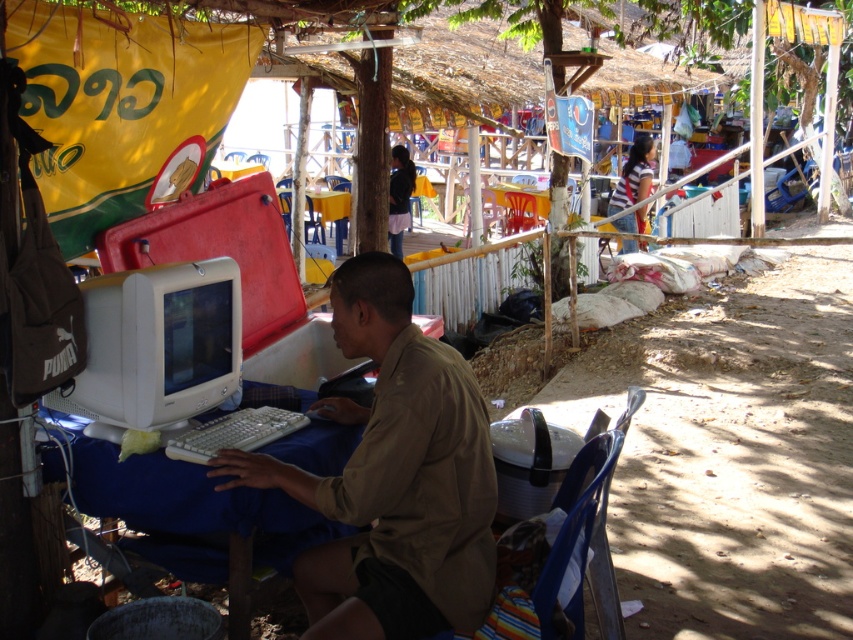
Question: Which object appears farthest from the camera in this image?

Choices:
 (A) white plastic table at center
 (B) matte beige shirt at center

Answer: (A)

Question: Is matte beige shirt at center bigger than white plastic table at center?

Choices:
 (A) no
 (B) yes

Answer: (B)

Question: Is matte beige shirt at center above white plastic table at center?

Choices:
 (A) no
 (B) yes

Answer: (B)

Question: Which point appears farthest from the camera in this image?

Choices:
 (A) click(93, 445)
 (B) click(352, 548)

Answer: (A)

Question: Does matte beige shirt at center appear on the left side of white plastic table at center?

Choices:
 (A) no
 (B) yes

Answer: (A)